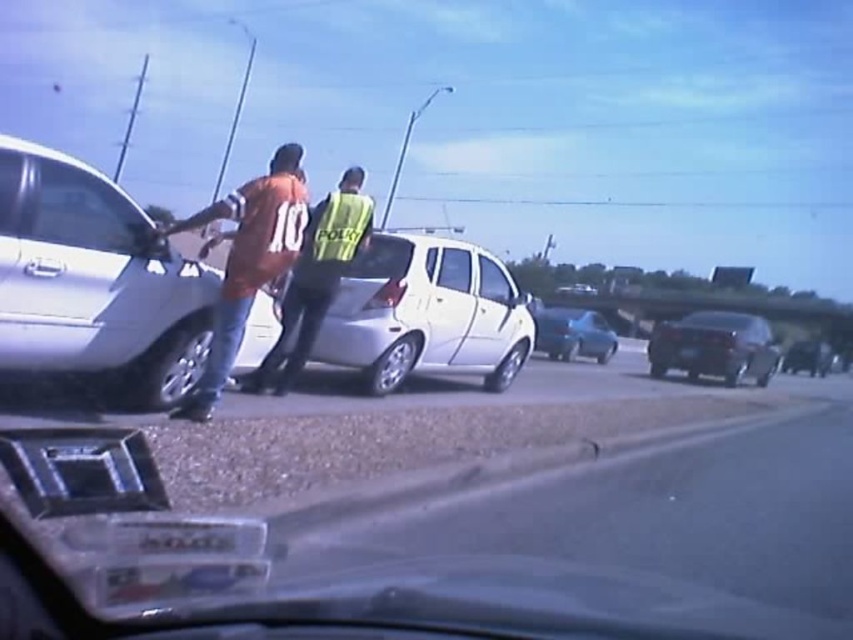
Is silver metallic sedan at left to the right of white matte sedan at center from the viewer's perspective?

Incorrect, silver metallic sedan at left is not on the right side of white matte sedan at center.

Between silver metallic sedan at left and white matte sedan at center, which one appears on the right side from the viewer's perspective?

white matte sedan at center is more to the right.

Does point (38, 212) come behind point (556, 291)?

That is False.

Identify the location of silver metallic sedan at left. (94, 280).

Describe the element at coordinates (247, 260) in the screenshot. I see `orange jersey at left` at that location.

Is orange jersey at left thinner than reflective yellow vest at center?

Correct, orange jersey at left's width is less than reflective yellow vest at center's.

Which is in front, point (230, 253) or point (314, 320)?

Positioned in front is point (230, 253).

Identify the location of orange jersey at left. (247, 260).

Is the position of reflective yellow vest at center more distant than that of black glossy sedan at center?

No, reflective yellow vest at center is closer to the viewer.

Describe the element at coordinates (316, 276) in the screenshot. I see `reflective yellow vest at center` at that location.

This screenshot has width=853, height=640. What do you see at coordinates (316, 276) in the screenshot?
I see `reflective yellow vest at center` at bounding box center [316, 276].

Locate an element on the screen. reflective yellow vest at center is located at coordinates (316, 276).